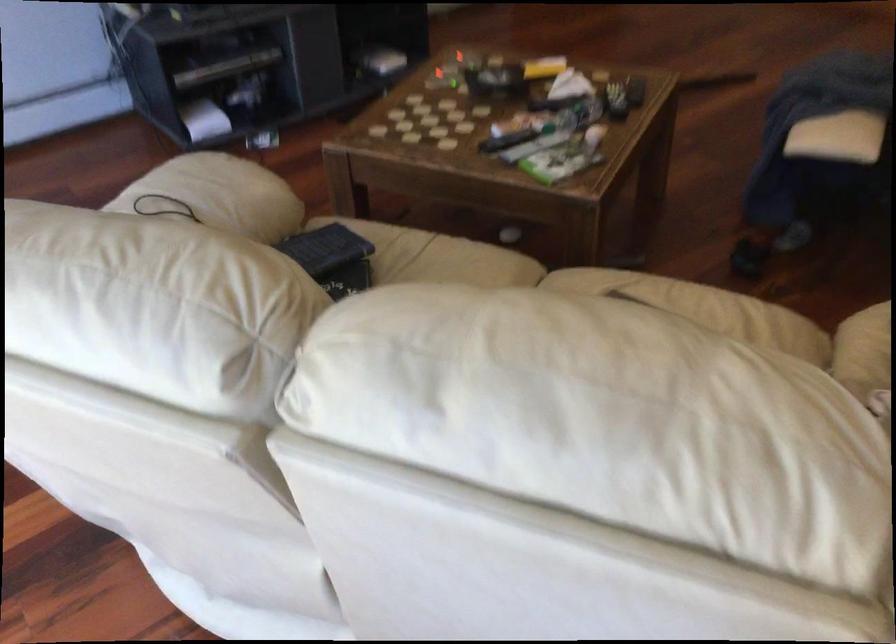
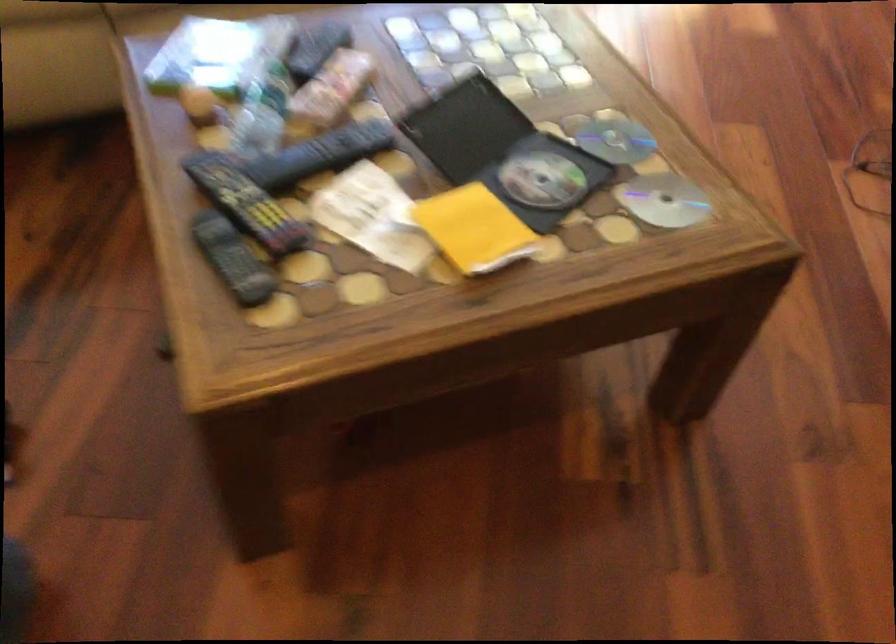
Find the pixel in the second image that matches [569,96] in the first image.

(320, 154)